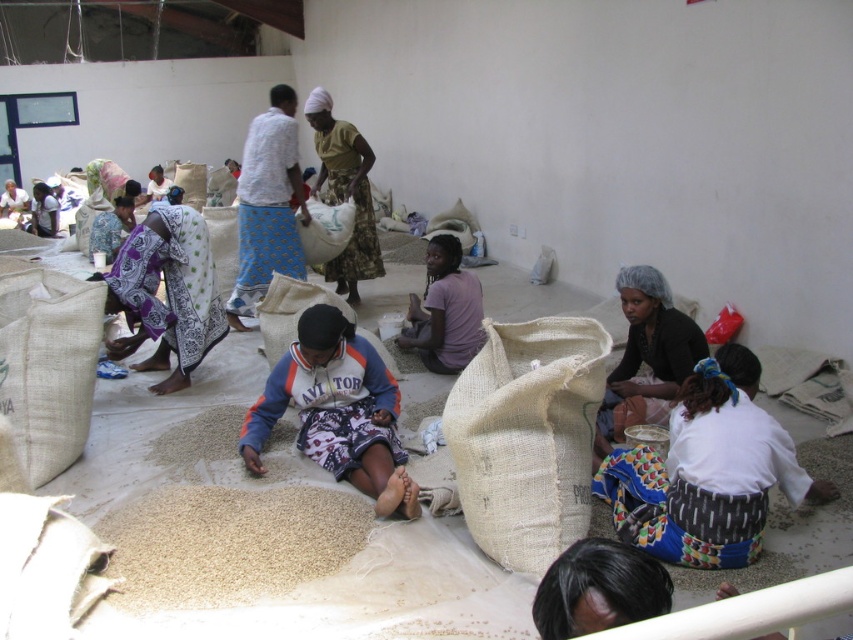
Does purple printed fabric at left appear over black hair net at center?

Correct, purple printed fabric at left is located above black hair net at center.

Measure the distance between purple printed fabric at left and camera.

4.25 meters

Where is `purple printed fabric at left`? This screenshot has width=853, height=640. purple printed fabric at left is located at coordinates (166, 292).

Is yellow-green fabric bag at center smaller than purple matte shirt at center?

No.

Is yellow-green fabric bag at center taller than purple matte shirt at center?

Yes.

Is point (345, 189) in front of point (438, 280)?

No, (345, 189) is behind (438, 280).

Identify the location of yellow-green fabric bag at center. The image size is (853, 640). (345, 193).

Is brown grain at center behind purple printed fabric at left?

No, it is in front of purple printed fabric at left.

Describe the element at coordinates (228, 541) in the screenshot. Image resolution: width=853 pixels, height=640 pixels. I see `brown grain at center` at that location.

Identify the location of brown grain at center. click(x=228, y=541).